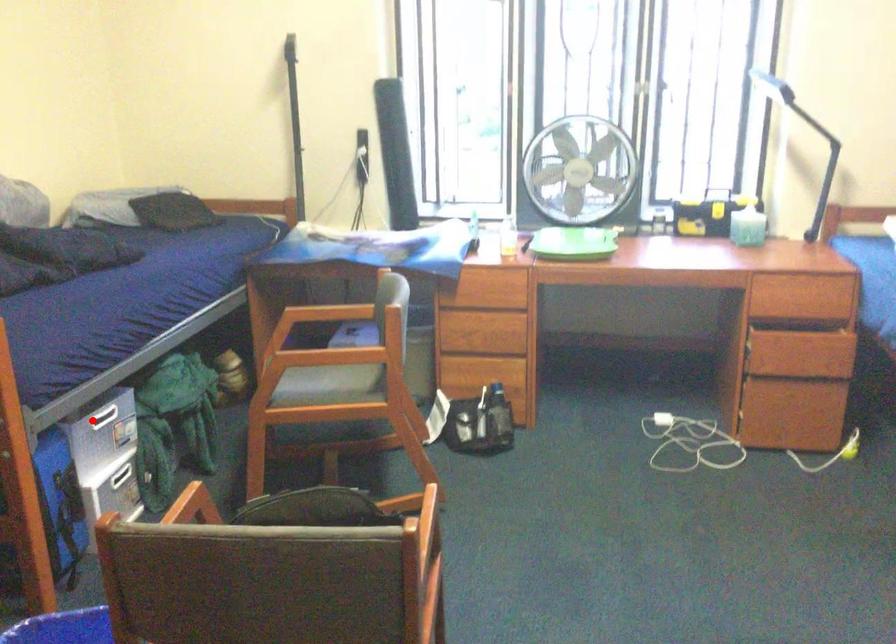
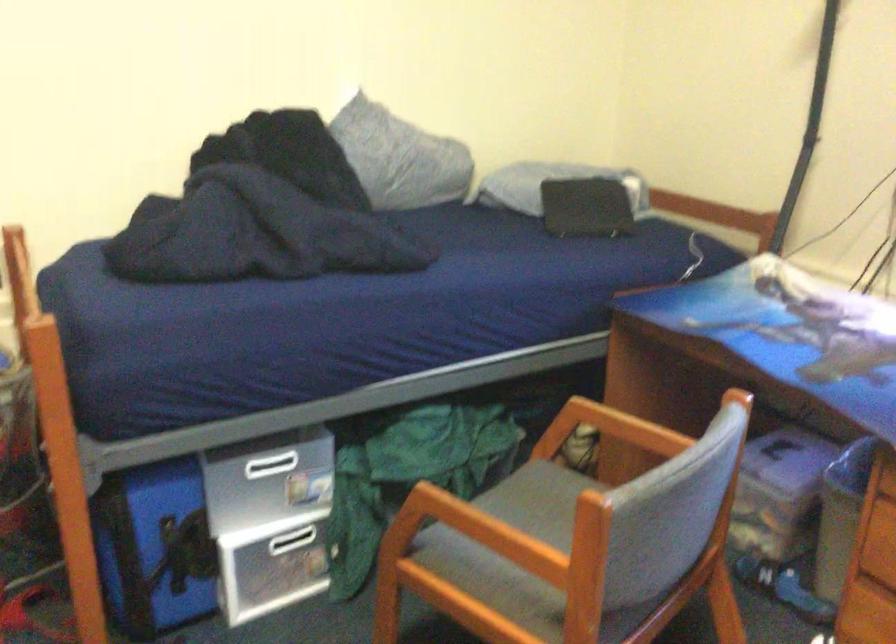
Question: I am providing you with two images of the same scene from different viewpoints. In image1, a red point is highlighted. Considering the same 3D point in image2, which of the following is correct?

Choices:
 (A) It is closer
 (B) It is farther

Answer: (A)